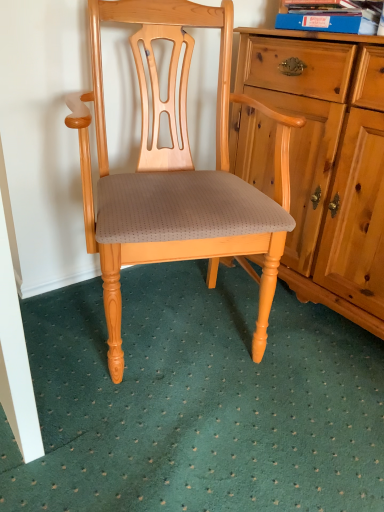
Identify the location of blank area beneath matte wood chair at center (from a real-world perspective). (188, 335).